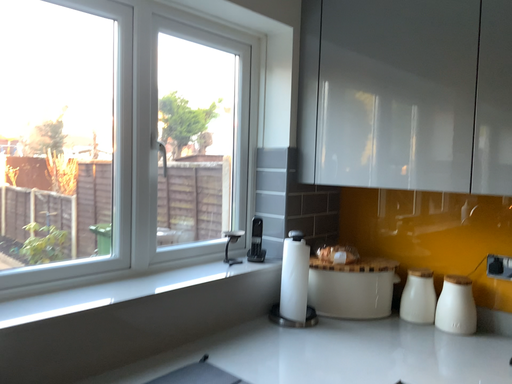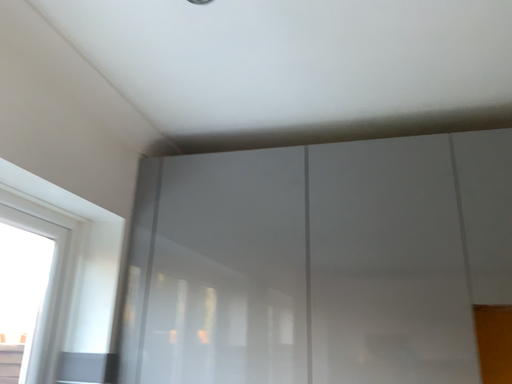
Question: How did the camera likely rotate when shooting the video?

Choices:
 (A) rotated upward
 (B) rotated downward

Answer: (A)